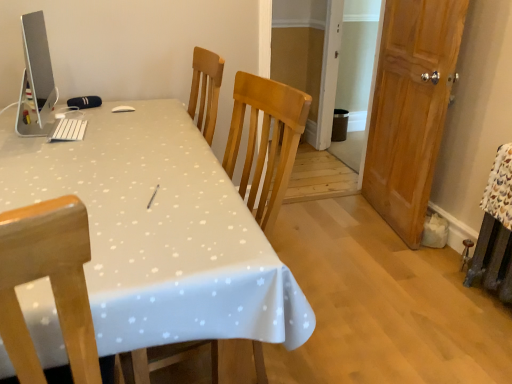
The height and width of the screenshot is (384, 512). In order to click on vacant area that is in front of sleek silver monitor at upper left in this screenshot , I will do `click(39, 159)`.